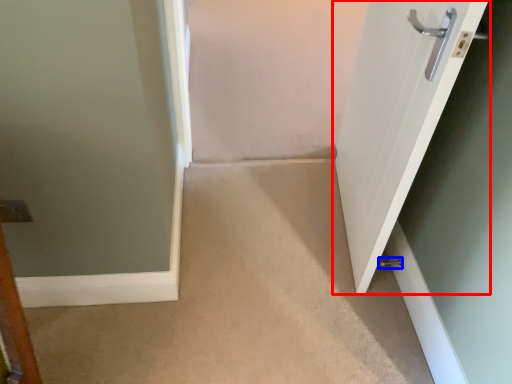
Question: Which object appears farthest to the camera in this image, door (highlighted by a red box) or door handle (highlighted by a blue box)?

Choices:
 (A) door
 (B) door handle

Answer: (B)